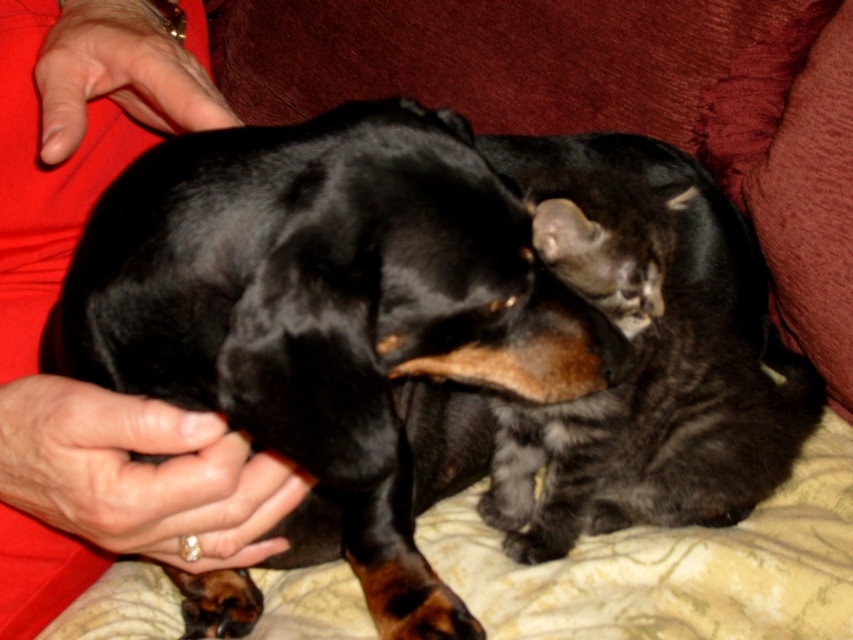
Where is the black shiny dog at center located in the image?

The black shiny dog at center is located at point (335, 321).

You are a pet owner who wants to ensure the dog stays warm during this interaction. Given the black shiny dog at center is under the smooth red shirt at upper left, does the dog have any coverage from the shirt?

The black shiny dog at center is positioned under the smooth red shirt at upper left, so the shirt is covering the dog and providing warmth.

You are a photographer standing in front of the black shiny dog at center. You want to take a clear photo of it. The camera you are using has a minimum focusing distance of 15 inches. Can you take the photo without moving closer?

The distance between you and the black shiny dog at center is 15.19 inches, which is just above the camera minimum focusing distance of 15 inches. Therefore, you can take the photo without moving closer.